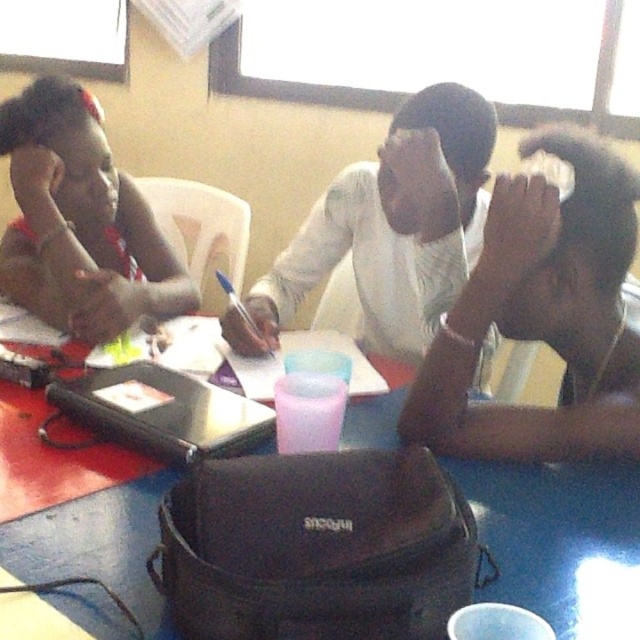
You are a student sitting at the blue table at the forefront. You need to reach for the black matte laptop at center to take a photo. Can you easily reach it without moving your smooth skin head at center?

The smooth skin head at center is further to the viewer than black matte laptop at center, so the laptop is behind your head. You would need to move your head or adjust your position to reach it.

Consider the image. You are a student in the classroom and need to place a 15 cm tall textbook on the blue plastic table at center. Based on the height of the smooth skin head at center, will the textbook be visible from the floor level?

The smooth skin head at center is much taller than the blue plastic table at center, so the textbook placed on the blue plastic table at center may be partially or fully obstructed by the head from floor level.

You are standing in the classroom and want to reach both points on the table. Which point, point (516, 600) or point (33, 102), is closer to you?

Point (516, 600) is closer to the viewer than point (33, 102).